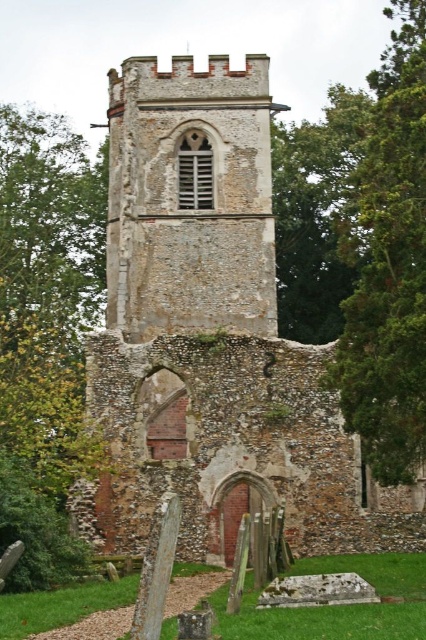
You are standing at the base of the green leafy tree at left and want to climb up to the brown stone church at center. Is the church above or below your current position?

The brown stone church at center is above the green leafy tree at left, so you are currently below the church and can climb up to reach it.

You are standing at the center of the ruins of an old church. There is a point marked at coordinates (x=212, y=337). Based on the scene description, what does this point most likely represent?

The point at coordinates (x=212, y=337) most likely represents the brown stone church at center as indicated by the Objects Description.